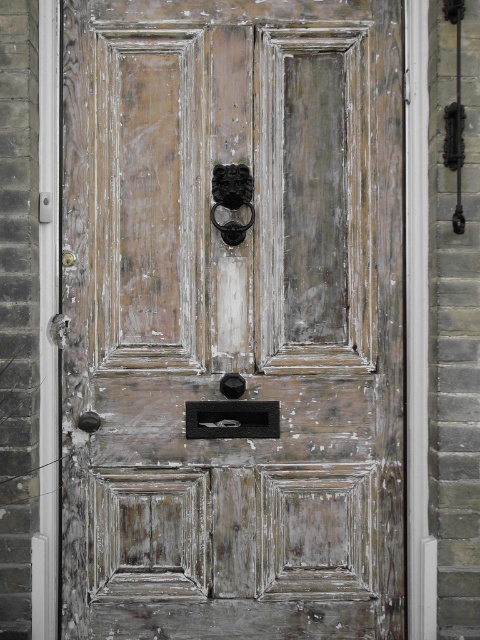
You are standing in front of a door and want to check if there is a knocker. Based on the scene description, can you confirm if the door at point [232,317] has a knocker?

The distressed wood door at center has a prominent black lion head knocker at its center, so yes, the door at point [232,317] does have a knocker.

You are a painter standing in front of the distressed wood door at center and the black textured knocker at center. You need to paint both objects. Which object will require more ladder steps to reach its top due to its height?

The distressed wood door at center has a greater height compared to the black textured knocker at center, so you will need more ladder steps to reach the top of the distressed wood door at center.